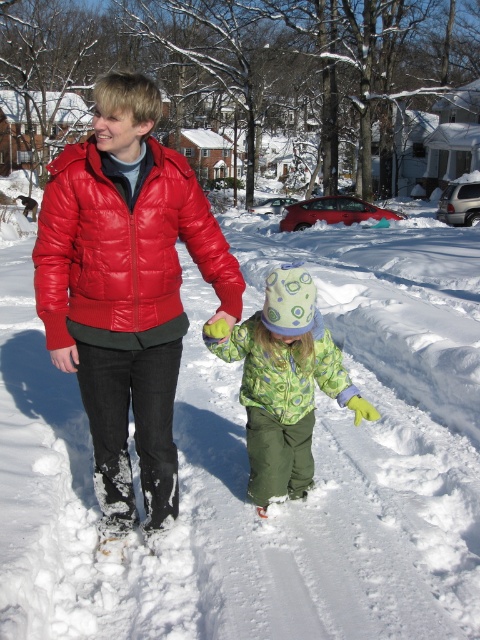
Based on the photo, which of these two, white fluffy snow at center or green textured jacket at center, stands taller?

white fluffy snow at center is taller.

Where is `white fluffy snow at center`? white fluffy snow at center is located at coordinates (247, 464).

Is point (189, 630) farther from camera compared to point (279, 342)?

No.

Find the location of a particular element. This screenshot has width=480, height=640. white fluffy snow at center is located at coordinates (247, 464).

How distant is green fuzzy coat at center from green textured jacket at center?

green fuzzy coat at center is 2.72 inches away from green textured jacket at center.

Who is lower down, green fuzzy coat at center or green textured jacket at center?

green fuzzy coat at center is lower down.

What do you see at coordinates (284, 381) in the screenshot? This screenshot has height=640, width=480. I see `green fuzzy coat at center` at bounding box center [284, 381].

Image resolution: width=480 pixels, height=640 pixels. I want to click on green fuzzy coat at center, so click(284, 381).

Is point (106, 292) more distant than point (315, 374)?

No, it is in front of (315, 374).

What do you see at coordinates (126, 289) in the screenshot? Image resolution: width=480 pixels, height=640 pixels. I see `shiny red jacket at center` at bounding box center [126, 289].

Which is in front, point (172, 188) or point (335, 387)?

Positioned in front is point (172, 188).

I want to click on shiny red jacket at center, so click(x=126, y=289).